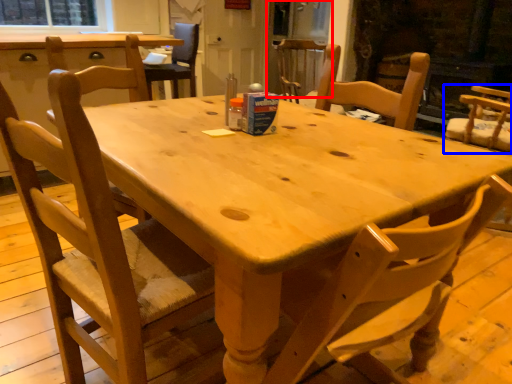
Question: Which point is further to the camera, screen door (highlighted by a red box) or chair (highlighted by a blue box)?

Choices:
 (A) screen door
 (B) chair

Answer: (A)